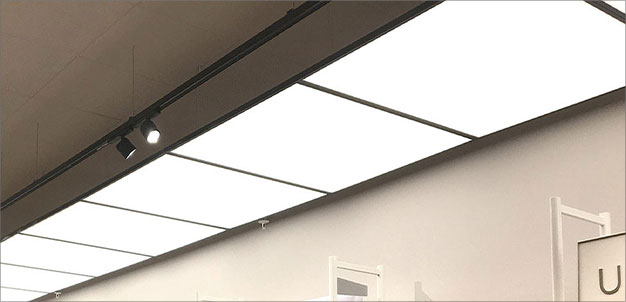
The image size is (626, 302). In order to click on lines on the ceiling in this screenshot , I will do `click(67, 61)`, `click(93, 108)`, `click(196, 29)`.